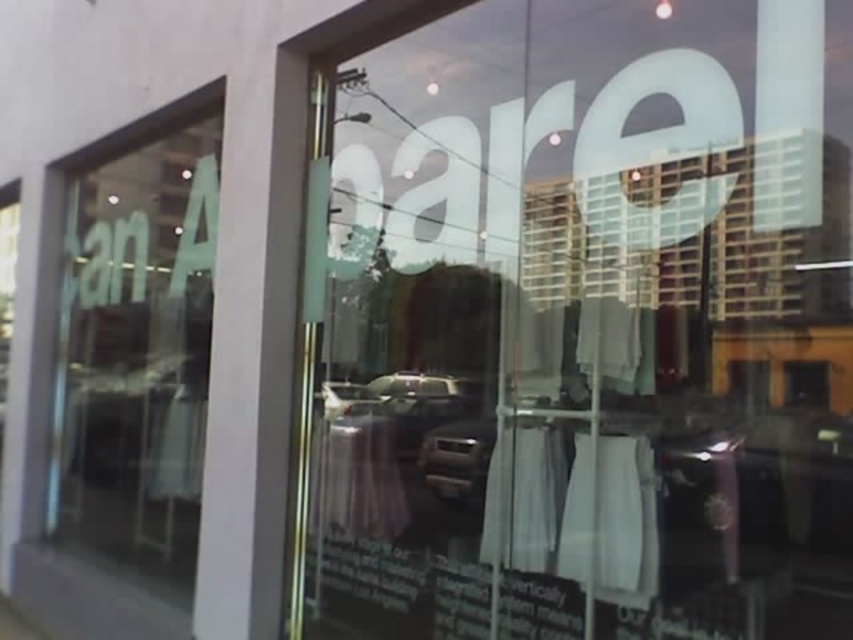
Question: Which object is farther from the camera taking this photo?

Choices:
 (A) transparent glass display at center
 (B) metallic silver car at center

Answer: (B)

Question: Is transparent glass window at upper left to the right of metallic silver car at center from the viewer's perspective?

Choices:
 (A) yes
 (B) no

Answer: (B)

Question: Does transparent glass window at upper left come in front of metallic silver car at center?

Choices:
 (A) yes
 (B) no

Answer: (A)

Question: Which of the following is the farthest from the observer?

Choices:
 (A) transparent glass display at center
 (B) transparent glass window at upper left
 (C) metallic silver car at center

Answer: (C)

Question: In this image, where is transparent glass window at upper left located relative to metallic silver car at center?

Choices:
 (A) left
 (B) right

Answer: (A)

Question: Among these objects, which one is farthest from the camera?

Choices:
 (A) transparent glass display at center
 (B) transparent glass window at upper left
 (C) metallic silver car at center

Answer: (C)